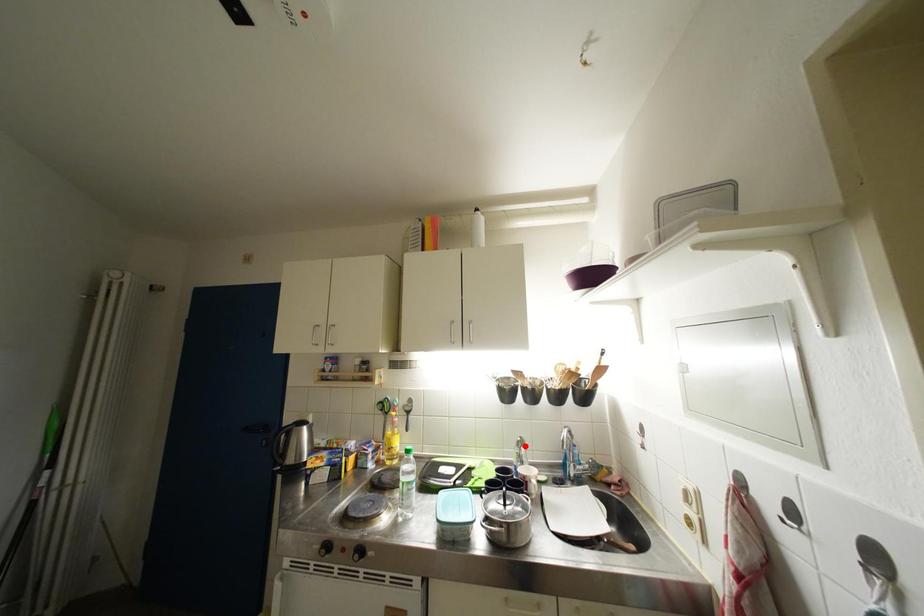
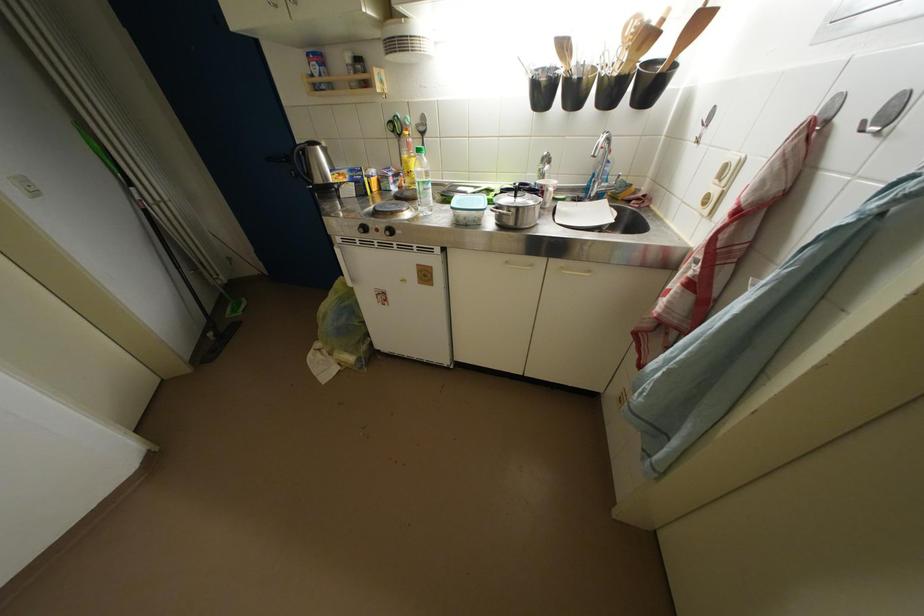
Question: I am providing you with two images of the same scene from different viewpoints. Image1 has a red point marked. In image2, the corresponding 3D location appears at what relative position? Reply with the corresponding letter.

Choices:
 (A) Closer
 (B) Farther

Answer: (A)